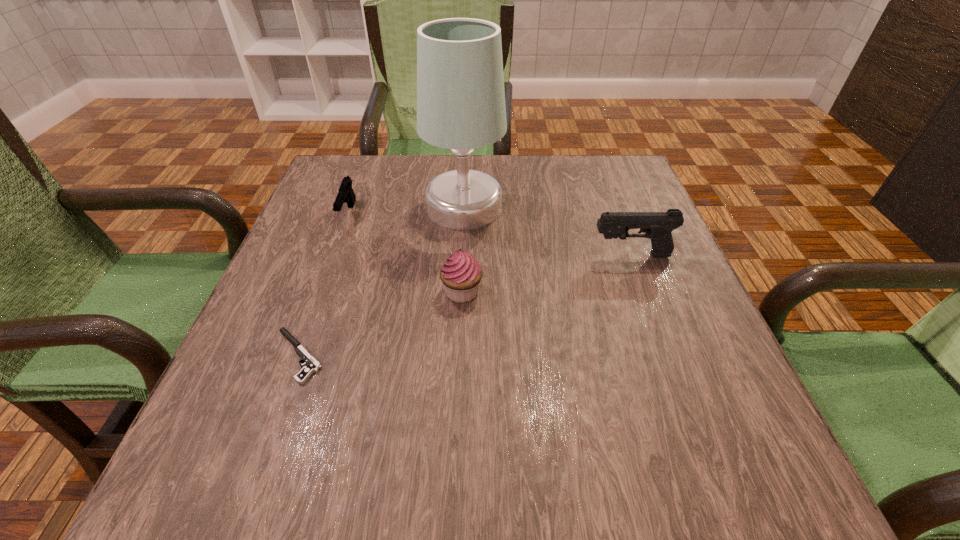
Find the location of a particular element. The height and width of the screenshot is (540, 960). the tallest object is located at coordinates (461, 106).

The image size is (960, 540). I want to click on the third nearest object, so click(x=657, y=226).

Where is `the rightmost pistol`? Image resolution: width=960 pixels, height=540 pixels. the rightmost pistol is located at coordinates (657, 226).

Locate an element on the screen. This screenshot has width=960, height=540. cupcake is located at coordinates (461, 273).

Find the location of a particular element. The height and width of the screenshot is (540, 960). the second shortest pistol is located at coordinates (346, 194).

The height and width of the screenshot is (540, 960). What are the coordinates of `the farthest pistol` in the screenshot? It's located at (346, 194).

Identify the location of the shortest object. Image resolution: width=960 pixels, height=540 pixels. (313, 365).

The image size is (960, 540). I want to click on the nearest object, so click(313, 365).

The width and height of the screenshot is (960, 540). In order to click on free location located 0.250m on the base of the lampshade in this screenshot , I will do `click(607, 207)`.

Locate an element on the screen. The width and height of the screenshot is (960, 540). vacant region located 0.400m at the barrel of the rightmost object is located at coordinates (403, 255).